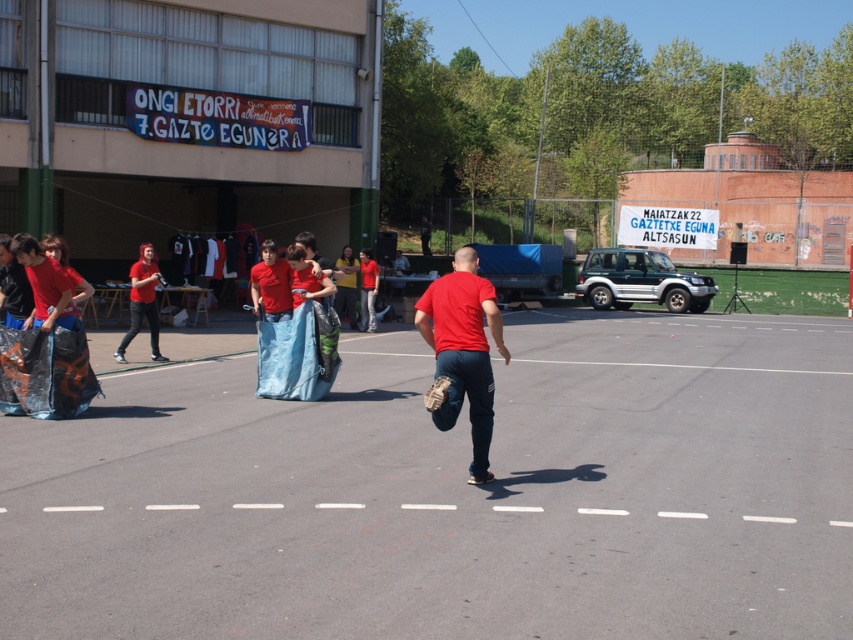
Does matte red shirt at center lie behind matte red shirt at left?

That is False.

The image size is (853, 640). What do you see at coordinates (462, 353) in the screenshot? I see `matte red shirt at center` at bounding box center [462, 353].

I want to click on matte red shirt at center, so click(462, 353).

This screenshot has width=853, height=640. What are the coordinates of `matte red shirt at center` in the screenshot? It's located at (462, 353).